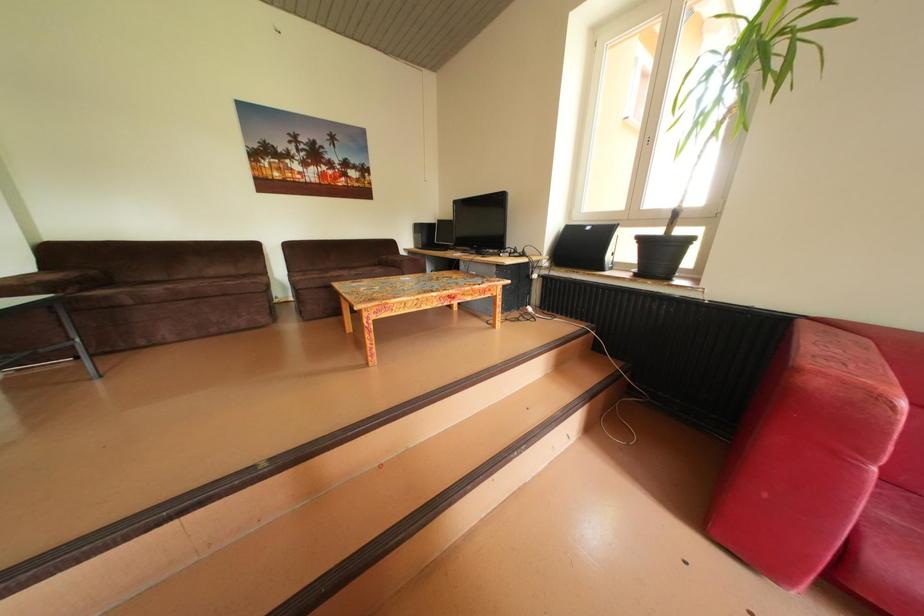
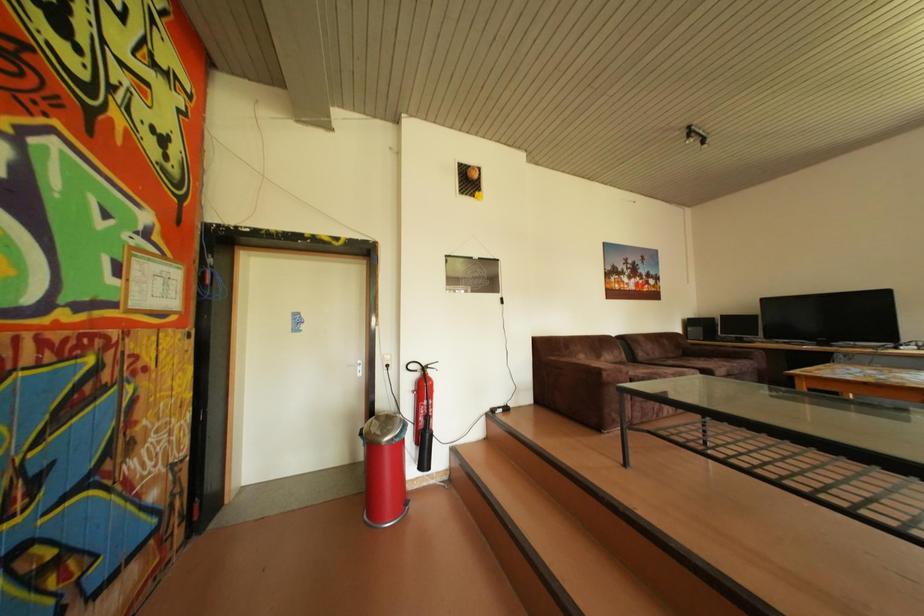
Question: What movement of the cameraman would produce the second image?

Choices:
 (A) Left
 (B) Right
 (C) Forward
 (D) Backward

Answer: (A)